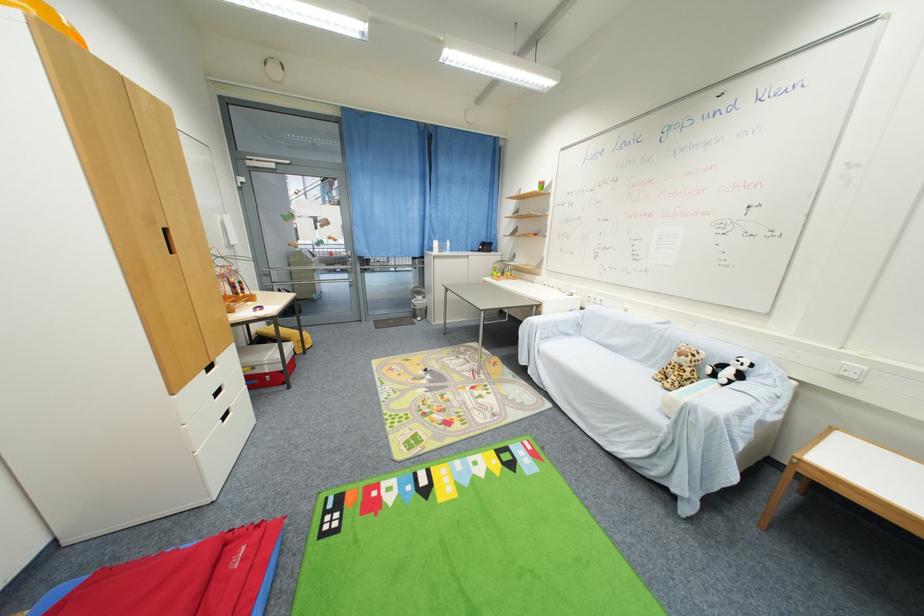
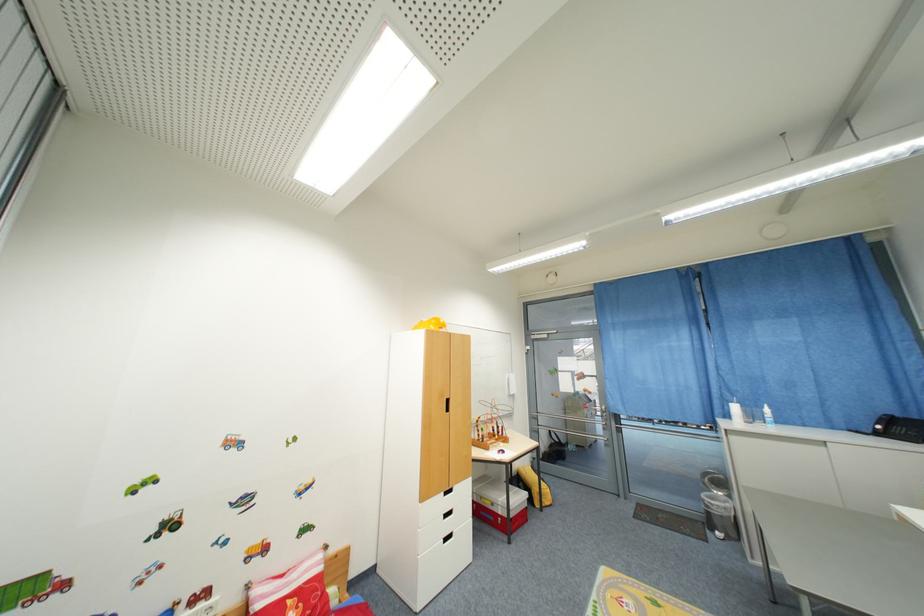
Question: I am providing you with two images of the same scene from different viewpoints. Which of the following objects are not visible in image2?

Choices:
 (A) red and white box
 (B) white pump bottle
 (C) white drawer handle
 (D) none of these

Answer: (D)